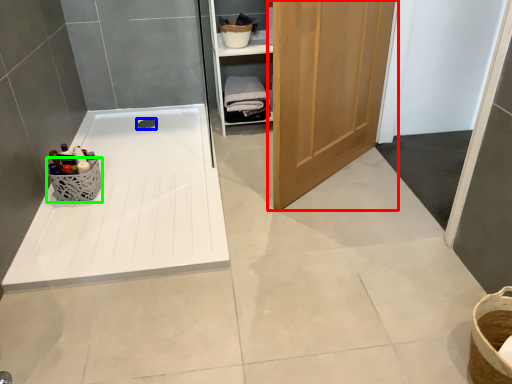
Question: Considering the real-world distances, which object is farthest from door (highlighted by a red box)? drain (highlighted by a blue box) or basket (highlighted by a green box)?

Choices:
 (A) drain
 (B) basket

Answer: (A)